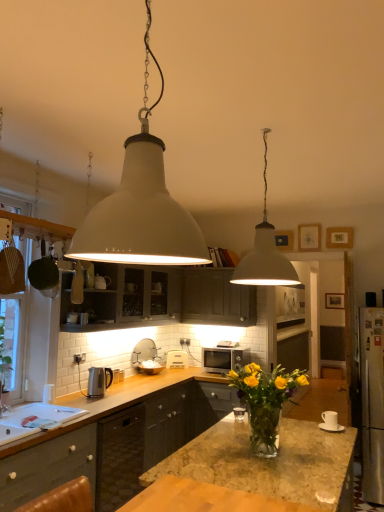
Question: Can you confirm if white matte picture frame at upper center, marked as the first picture frame in a top-to-bottom arrangement, is wider than white matte pendant light at upper center, which ranks as the 1th lamp in front-to-back order?

Choices:
 (A) yes
 (B) no

Answer: (B)

Question: Is white matte picture frame at upper center, marked as the first picture frame in a top-to-bottom arrangement, positioned with its back to white matte pendant light at upper center, which is counted as the 1th lamp, starting from the left?

Choices:
 (A) yes
 (B) no

Answer: (B)

Question: Is white matte picture frame at upper center, the 2th picture frame viewed from the front, to the right of white matte pendant light at upper center, the second lamp viewed from the back, from the viewer's perspective?

Choices:
 (A) yes
 (B) no

Answer: (A)

Question: From a real-world perspective, is white matte picture frame at upper center, arranged as the 1th picture frame when viewed from the left, physically above white matte pendant light at upper center, the 2th lamp viewed from the right?

Choices:
 (A) yes
 (B) no

Answer: (A)

Question: Is white matte picture frame at upper center, marked as the first picture frame in a top-to-bottom arrangement, outside white matte pendant light at upper center, the second lamp viewed from the back?

Choices:
 (A) no
 (B) yes

Answer: (B)

Question: In the image, is granite countertop at center on the left side or the right side of wooden picture frame at upper right, the 3th picture frame from the back?

Choices:
 (A) right
 (B) left

Answer: (B)

Question: Considering the positions of point (264, 473) and point (342, 233), is point (264, 473) closer or farther from the camera than point (342, 233)?

Choices:
 (A) closer
 (B) farther

Answer: (A)

Question: Considering the positions of granite countertop at center and wooden picture frame at upper right, the second picture frame viewed from the right, in the image, is granite countertop at center wider or thinner than wooden picture frame at upper right, the second picture frame viewed from the right,?

Choices:
 (A) wide
 (B) thin

Answer: (A)

Question: From a real-world perspective, is granite countertop at center physically located above or below wooden picture frame at upper right, marked as the 2th picture frame in a top-to-bottom arrangement?

Choices:
 (A) below
 (B) above

Answer: (A)

Question: In terms of width, does wooden picture frame at upper right, the 3th picture frame from the back, look wider or thinner when compared to matte gray cabinet at upper center, the 2th cabinetry positioned from the back?

Choices:
 (A) wide
 (B) thin

Answer: (B)

Question: From the image's perspective, relative to matte gray cabinet at upper center, which is the 2th cabinetry in front-to-back order, is wooden picture frame at upper right, the 3th picture frame from the back, above or below?

Choices:
 (A) below
 (B) above

Answer: (B)

Question: Is wooden picture frame at upper right, the 3th picture frame from the back, in front of or behind matte gray cabinet at upper center, the 2th cabinetry positioned from the back, in the image?

Choices:
 (A) behind
 (B) front

Answer: (A)

Question: From a real-world perspective, is wooden picture frame at upper right, placed as the 1th picture frame when sorted from front to back, positioned above or below matte gray cabinet at upper center, the 2th cabinetry positioned from the back?

Choices:
 (A) below
 (B) above

Answer: (B)

Question: Visually, is white matte microwave at center, the first appliance when ordered from right to left, positioned to the left or to the right of granite countertop at center?

Choices:
 (A) right
 (B) left

Answer: (B)

Question: Considering the positions of white matte microwave at center, marked as the second appliance in a front-to-back arrangement, and granite countertop at center in the image, is white matte microwave at center, marked as the second appliance in a front-to-back arrangement, taller or shorter than granite countertop at center?

Choices:
 (A) short
 (B) tall

Answer: (B)